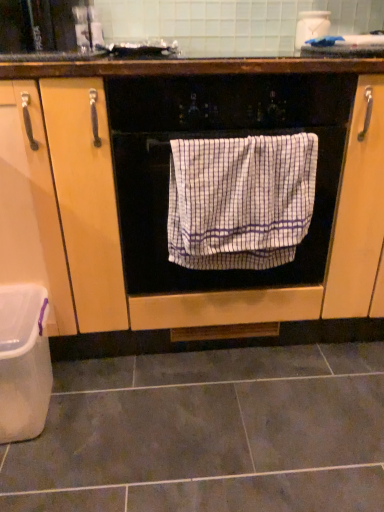
Locate an element on the screen. The height and width of the screenshot is (512, 384). empty space that is ontop of white checkered towel at center is located at coordinates (243, 133).